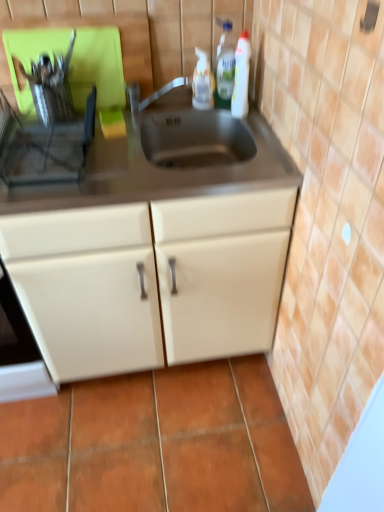
Question: Which direction should I rotate to look at translucent plastic spray bottle at upper center, the first bottle viewed from the left, — up or down?

Choices:
 (A) up
 (B) down

Answer: (A)

Question: Is translucent plastic spray bottle at upper center, the 3th bottle from the right, to the left of matte cream cabinet at center from the viewer's perspective?

Choices:
 (A) yes
 (B) no

Answer: (B)

Question: Is translucent plastic spray bottle at upper center, the 3th bottle from the right, at the right side of matte cream cabinet at center?

Choices:
 (A) no
 (B) yes

Answer: (B)

Question: Is translucent plastic spray bottle at upper center, the first bottle viewed from the left, smaller than matte cream cabinet at center?

Choices:
 (A) yes
 (B) no

Answer: (A)

Question: From the image's perspective, is translucent plastic spray bottle at upper center, the first bottle viewed from the left, under matte cream cabinet at center?

Choices:
 (A) yes
 (B) no

Answer: (B)

Question: Is translucent plastic spray bottle at upper center, the first bottle viewed from the left, positioned with its back to matte cream cabinet at center?

Choices:
 (A) yes
 (B) no

Answer: (B)

Question: Is translucent plastic spray bottle at upper center, the 3th bottle from the right, outside matte cream cabinet at center?

Choices:
 (A) yes
 (B) no

Answer: (A)

Question: Is metallic silver dish rack at left shorter than translucent plastic bottle at upper right, marked as the 2th bottle in a left-to-right arrangement?

Choices:
 (A) no
 (B) yes

Answer: (B)

Question: Is metallic silver dish rack at left oriented towards translucent plastic bottle at upper right, marked as the second bottle in a right-to-left arrangement?

Choices:
 (A) yes
 (B) no

Answer: (B)

Question: From the image's perspective, would you say metallic silver dish rack at left is positioned over translucent plastic bottle at upper right, marked as the second bottle in a right-to-left arrangement?

Choices:
 (A) no
 (B) yes

Answer: (A)

Question: Would you consider metallic silver dish rack at left to be distant from translucent plastic bottle at upper right, marked as the 2th bottle in a left-to-right arrangement?

Choices:
 (A) no
 (B) yes

Answer: (A)

Question: Does metallic silver dish rack at left have a greater width compared to translucent plastic bottle at upper right, marked as the 2th bottle in a left-to-right arrangement?

Choices:
 (A) no
 (B) yes

Answer: (B)

Question: Could translucent plastic bottle at upper right, marked as the 2th bottle in a left-to-right arrangement, be considered to be inside metallic silver dish rack at left?

Choices:
 (A) yes
 (B) no

Answer: (B)

Question: From the image's perspective, is translucent plastic bottle at upper right, marked as the second bottle in a right-to-left arrangement, on top of white plastic bottle at upper right, which ranks as the 1th bottle in right-to-left order?

Choices:
 (A) yes
 (B) no

Answer: (A)